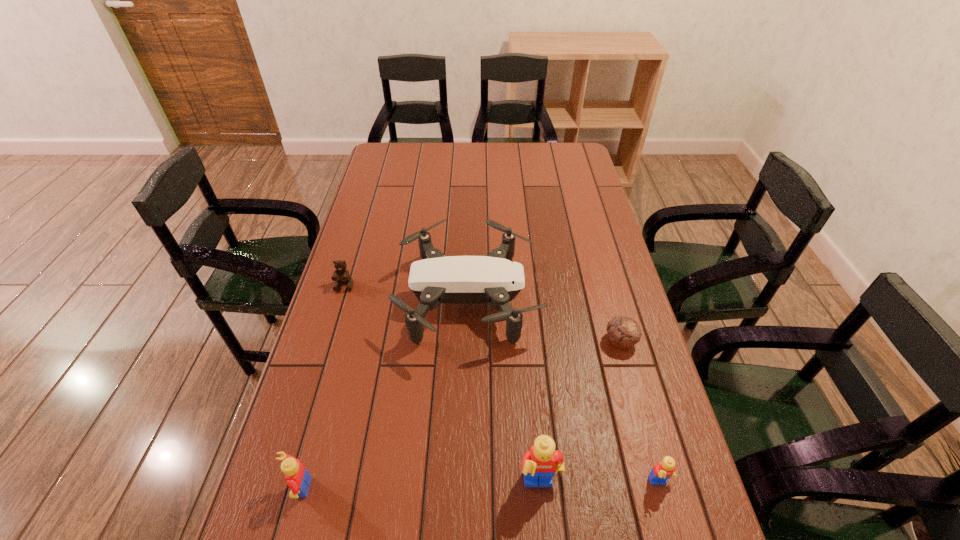
In order to click on the leftmost Lego in this screenshot , I will do `click(298, 479)`.

Where is `the third tallest object`? the third tallest object is located at coordinates (298, 479).

I want to click on the tallest object, so click(x=539, y=464).

Where is `the second Lego from right to left`? The height and width of the screenshot is (540, 960). the second Lego from right to left is located at coordinates pos(539,464).

This screenshot has width=960, height=540. I want to click on the shortest Lego, so click(x=662, y=471).

The height and width of the screenshot is (540, 960). What are the coordinates of `drone` in the screenshot? It's located at [495, 279].

The width and height of the screenshot is (960, 540). What are the coordinates of `muffin` in the screenshot? It's located at (623, 331).

I want to click on teddy bear, so click(x=341, y=275).

Find the location of a particular element. The height and width of the screenshot is (540, 960). vacant space located 0.060m on the face of the tallest Lego is located at coordinates (544, 535).

Find the location of a particular element. free space located on the face of the rightmost Lego is located at coordinates coord(669,519).